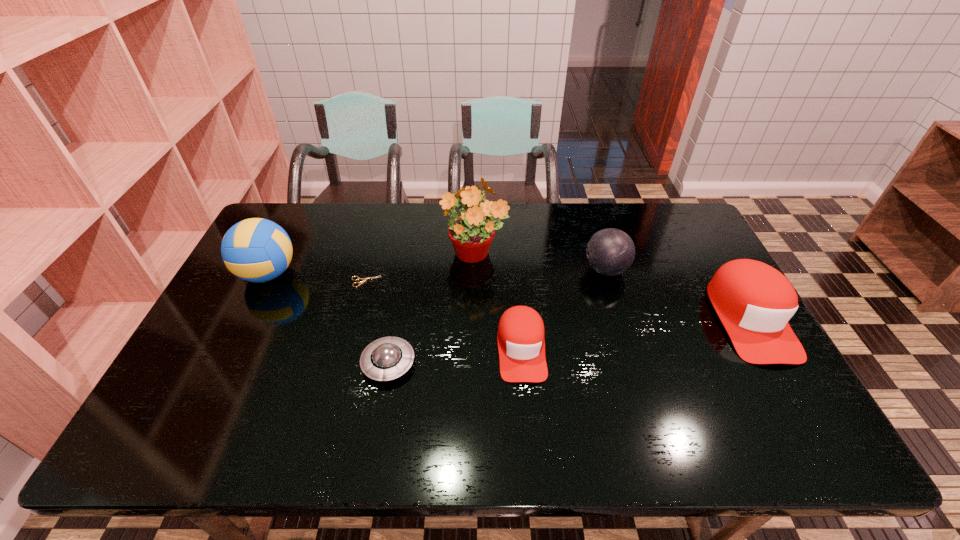
What are the coordinates of `empty location between the shortest object and the bowling ball` in the screenshot? It's located at (486, 275).

Identify the location of vacant area between the bowling ball and the leftmost object. (437, 272).

Image resolution: width=960 pixels, height=540 pixels. I want to click on empty location between the shears and the saucer, so click(377, 322).

Where is `free spot between the shortest object and the fifth tallest object`? free spot between the shortest object and the fifth tallest object is located at coordinates (444, 315).

This screenshot has height=540, width=960. I want to click on unoccupied area between the saucer and the tallest object, so click(432, 309).

Image resolution: width=960 pixels, height=540 pixels. I want to click on free spot between the sixth shortest object and the taller baseball cap, so click(509, 296).

The width and height of the screenshot is (960, 540). Identify the location of blank region between the sixth object from left to right and the shortest object. (486, 275).

The image size is (960, 540). What are the coordinates of `free spot between the shears and the leftmost object` in the screenshot? It's located at (317, 278).

The image size is (960, 540). I want to click on object that is the sixth closest to the second object from right to left, so click(x=257, y=250).

Where is `object that is the fifth closest to the tallest object`? This screenshot has width=960, height=540. object that is the fifth closest to the tallest object is located at coordinates (257, 250).